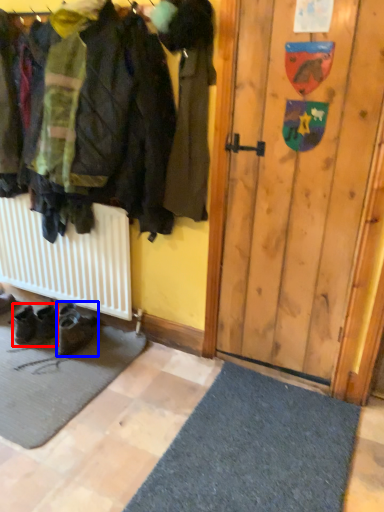
Question: Which point is further to the camera, footwear (highlighted by a red box) or footwear (highlighted by a blue box)?

Choices:
 (A) footwear
 (B) footwear

Answer: (A)